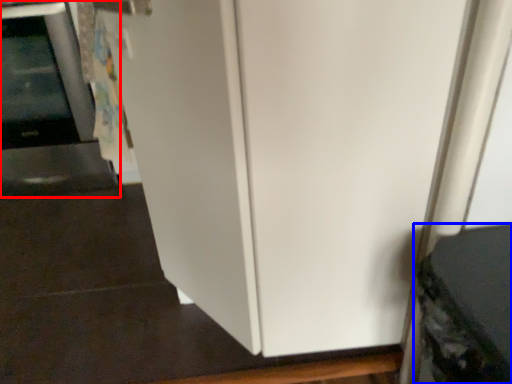
Question: Which point is further to the camera, appliance (highlighted by a red box) or appliance (highlighted by a blue box)?

Choices:
 (A) appliance
 (B) appliance

Answer: (A)